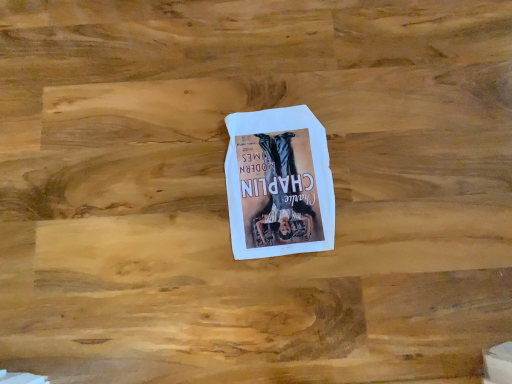
In order to click on free space above white paper at center (from a real-world perspective) in this screenshot , I will do `click(278, 173)`.